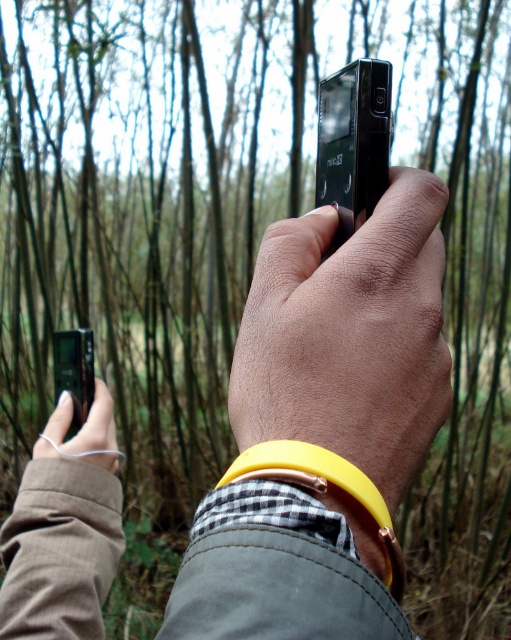
Between black matte phone at upper center and yellow rubber band at center, which one has more height?

black matte phone at upper center is taller.

In the scene shown: Can you confirm if black matte phone at upper center is positioned below yellow rubber band at center?

Yes.

This screenshot has height=640, width=511. What do you see at coordinates (322, 426) in the screenshot?
I see `black matte phone at upper center` at bounding box center [322, 426].

I want to click on black matte phone at upper center, so click(322, 426).

Is matte black camera at lower left wider than matte black smartphone at center?

Correct, the width of matte black camera at lower left exceeds that of matte black smartphone at center.

Is point (74, 442) more distant than point (55, 355)?

No, it is in front of (55, 355).

Where is `matte black camera at lower left`? Image resolution: width=511 pixels, height=640 pixels. matte black camera at lower left is located at coordinates (81, 433).

Who is positioned more to the left, yellow rubber band at center or matte black smartphone at center?

matte black smartphone at center

Is yellow rubber band at center to the left of matte black smartphone at center from the viewer's perspective?

No, yellow rubber band at center is not to the left of matte black smartphone at center.

The width and height of the screenshot is (511, 640). Identify the location of yellow rubber band at center. (350, 336).